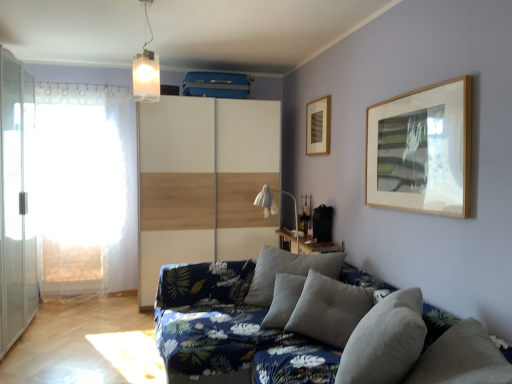
Find the location of a particular element. free space in front of white lace curtain at left is located at coordinates (72, 307).